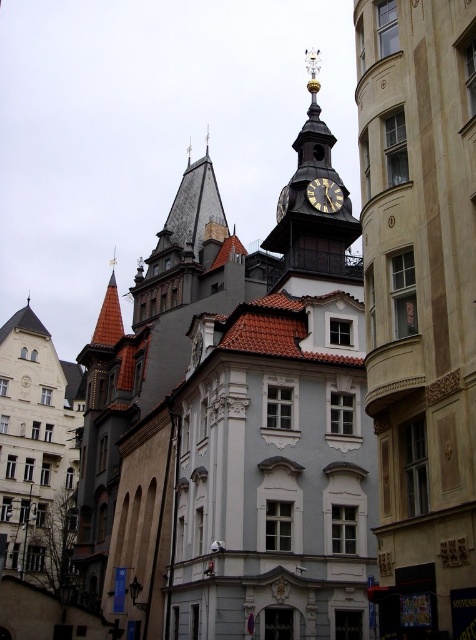
Is gold metallic clock tower at upper center wider than gold-toned metal clock at center?

Yes, gold metallic clock tower at upper center is wider than gold-toned metal clock at center.

The width and height of the screenshot is (476, 640). Find the location of `gold metallic clock tower at upper center`. gold metallic clock tower at upper center is located at coordinates (316, 202).

This screenshot has width=476, height=640. I want to click on gold metallic clock tower at upper center, so click(316, 202).

Is gold-toned metal clock at center positioned before gold metallic clock at upper center?

That is False.

Consider the image. Is gold-toned metal clock at center to the right of gold metallic clock at upper center from the viewer's perspective?

Yes, gold-toned metal clock at center is to the right of gold metallic clock at upper center.

Describe the element at coordinates (325, 195) in the screenshot. Image resolution: width=476 pixels, height=640 pixels. I see `gold-toned metal clock at center` at that location.

Identify the location of gold-toned metal clock at center. (325, 195).